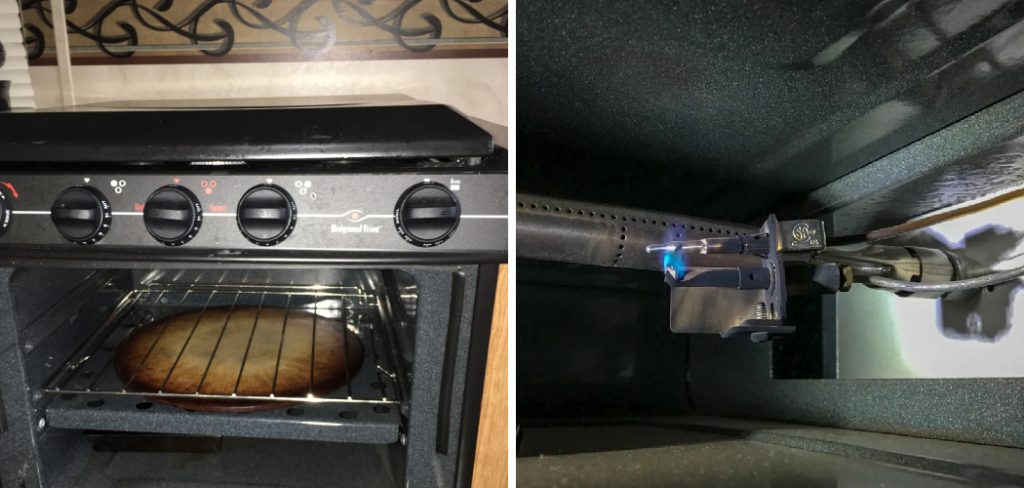
I want to click on white wall, so tap(280, 88).